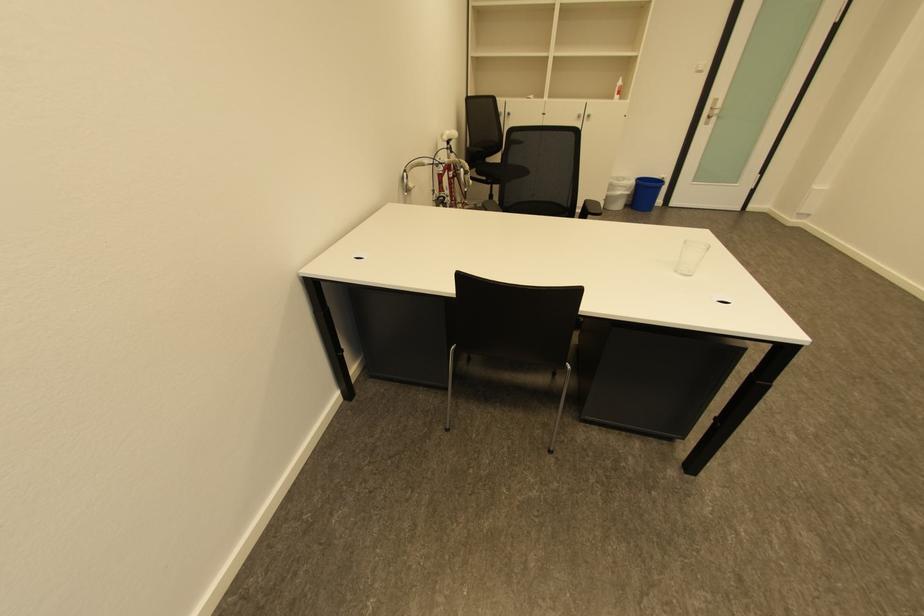
Locate an element on the screen. The image size is (924, 616). bicycle handlebar is located at coordinates (412, 176).